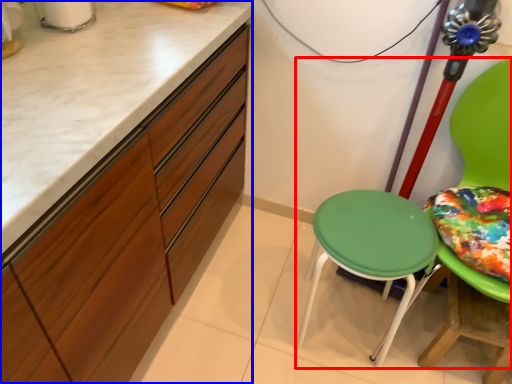
Question: Which of the following is the closest to the observer, chair (highlighted by a red box) or cabinetry (highlighted by a blue box)?

Choices:
 (A) chair
 (B) cabinetry

Answer: (B)